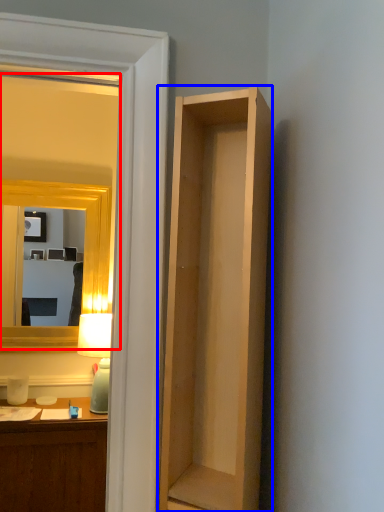
Question: Which point is further to the camera, mirror (highlighted by a red box) or cabinetry (highlighted by a blue box)?

Choices:
 (A) mirror
 (B) cabinetry

Answer: (A)